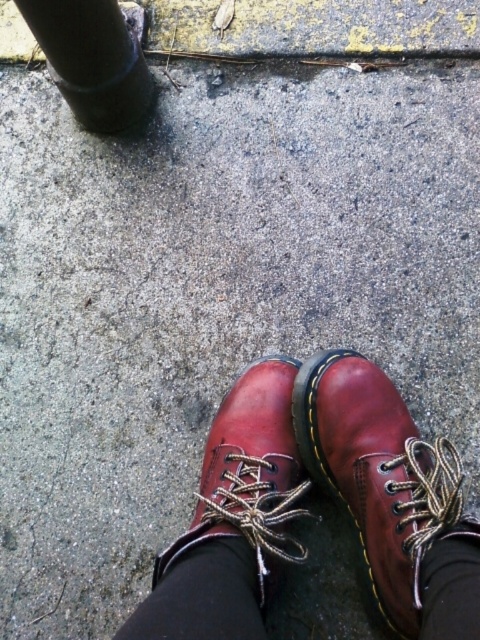
Question: Which point is farther from the camera taking this photo?

Choices:
 (A) (427, 580)
 (B) (240, 570)
 (C) (84, 84)
 (D) (327, 483)

Answer: (C)

Question: Is black matte pole at upper left behind black fabric sock at lower center?

Choices:
 (A) yes
 (B) no

Answer: (A)

Question: Is the position of shiny leather boots at center more distant than that of black matte pole at upper left?

Choices:
 (A) no
 (B) yes

Answer: (A)

Question: Which object is the farthest from the black fabric sock at lower center?

Choices:
 (A) shiny brown leather shoe at center
 (B) black matte pole at upper left

Answer: (B)

Question: Is shiny leather boot at center thinner than black fabric sock at lower center?

Choices:
 (A) no
 (B) yes

Answer: (A)

Question: Which point is closer to the camera taking this photo?

Choices:
 (A) (240, 579)
 (B) (309, 422)
 (C) (86, 108)
 (D) (260, 477)

Answer: (A)